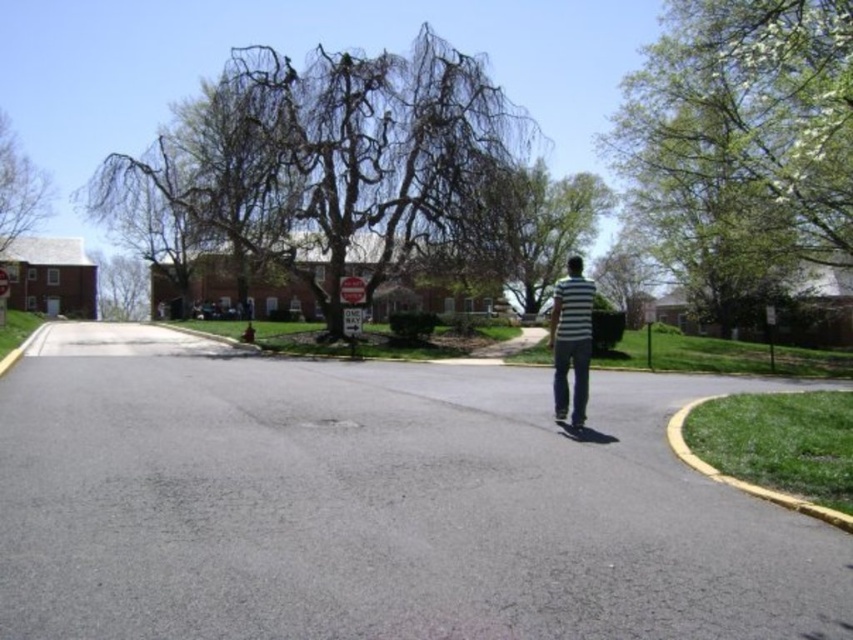
You are a drone operator trying to fly a drone from the dark brown textured tree at upper center to the green leafy tree at upper right. Based on the scene, can the drone fly directly between them without any obstacles?

The dark brown textured tree at upper center is positioned over the green leafy tree at upper right, which means there is no space between them for the drone to fly directly. The drone would need to navigate around the trees instead.

You are a pedestrian standing on the asphalt road and want to walk towards the brick building with white windows. Which direction should you walk relative to the dark brown textured tree at upper center and the green leafy tree at upper right?

You should walk towards the green leafy tree at upper right because the dark brown textured tree at upper center is to the left of it, meaning the brick building with white windows is in that direction.

You are a landscape architect analyzing the suburban scene. You need to determine which tree is taller between the green leafy tree at upper right and the green leafy tree at left. Based on the spatial information provided, which tree is taller?

The green leafy tree at left is taller than the green leafy tree at upper right.